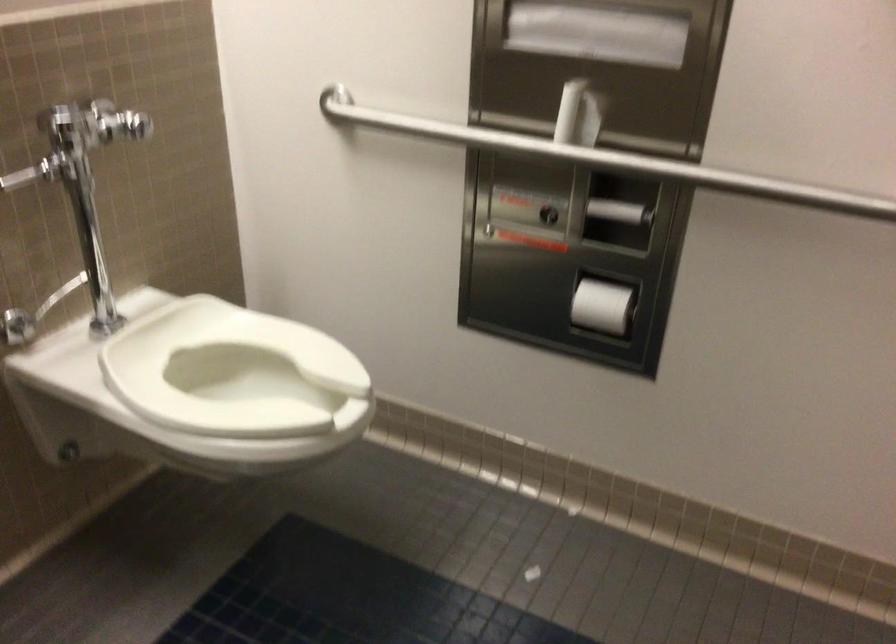
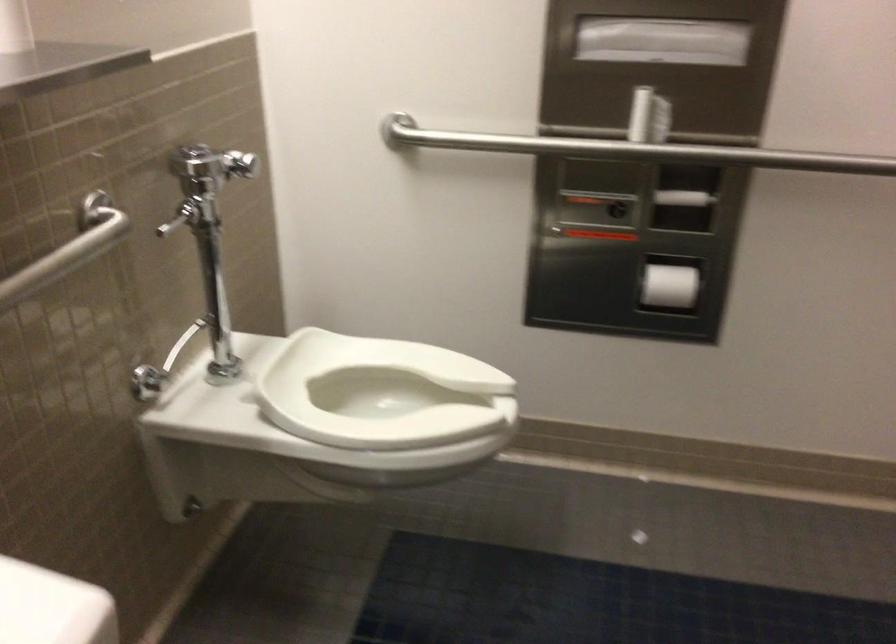
Where in the second image is the point corresponding to point (272, 373) from the first image?

(381, 393)